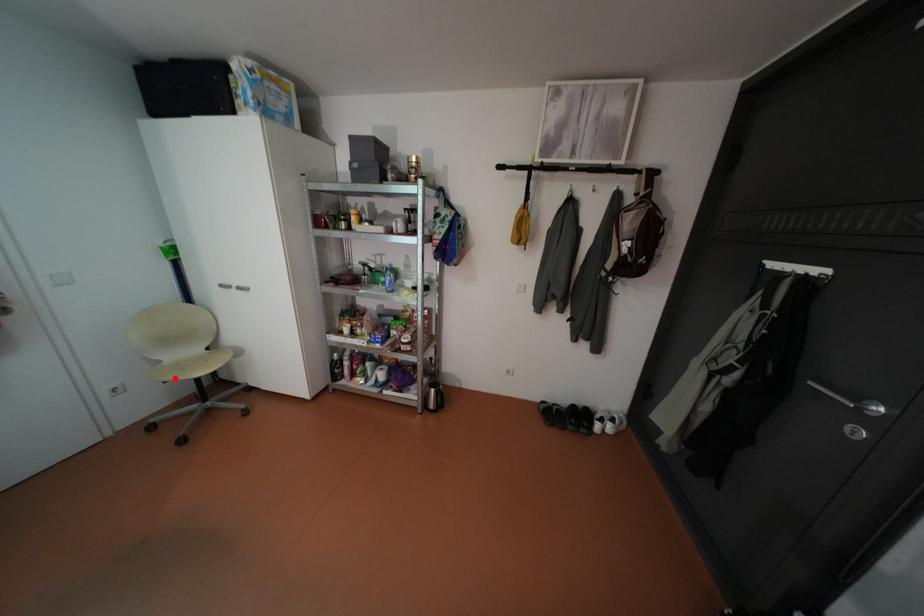
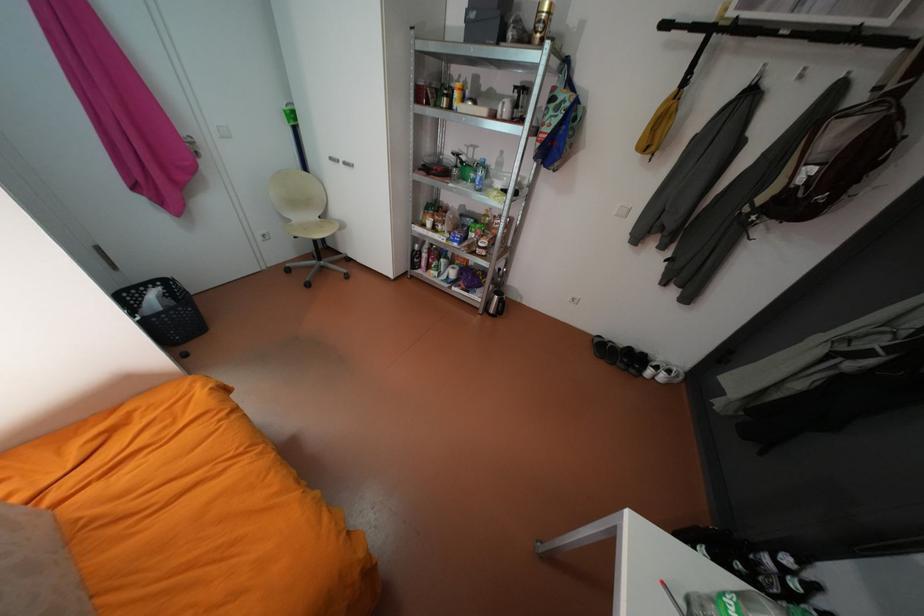
The point at the highlighted location is marked in the first image. Where is the corresponding point in the second image?

(306, 233)